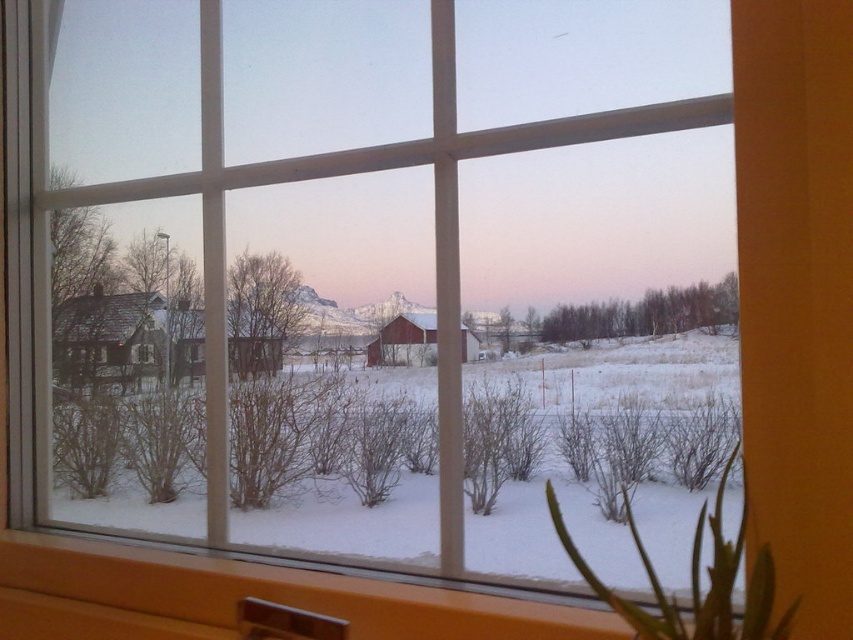
Question: Which of the following is the farthest from the observer?

Choices:
 (A) (199, 474)
 (B) (715, 545)

Answer: (A)

Question: Where is white fluffy snow at center located in relation to green leafy plant at lower right in the image?

Choices:
 (A) above
 (B) below

Answer: (B)

Question: Among these points, which one is farthest from the camera?

Choices:
 (A) (172, 419)
 (B) (621, 609)

Answer: (A)

Question: Is white fluffy snow at center to the left of green leafy plant at lower right from the viewer's perspective?

Choices:
 (A) yes
 (B) no

Answer: (A)

Question: Does white fluffy snow at center come behind green leafy plant at lower right?

Choices:
 (A) yes
 (B) no

Answer: (A)

Question: Which point is closer to the camera?

Choices:
 (A) (714, 538)
 (B) (308, 374)

Answer: (A)